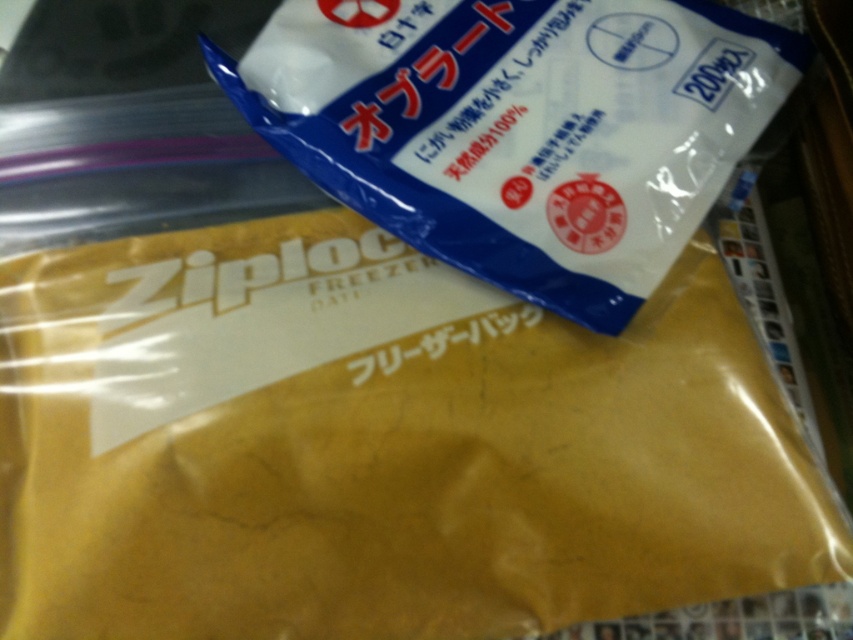
Question: Among these objects, which one is farthest from the camera?

Choices:
 (A) yellow matte ziploc bag at center
 (B) blue paper bag at upper center

Answer: (B)

Question: Can you confirm if yellow matte ziploc bag at center is thinner than blue paper bag at upper center?

Choices:
 (A) yes
 (B) no

Answer: (B)

Question: Does yellow matte ziploc bag at center appear on the right side of blue paper bag at upper center?

Choices:
 (A) no
 (B) yes

Answer: (A)

Question: Is yellow matte ziploc bag at center below blue paper bag at upper center?

Choices:
 (A) yes
 (B) no

Answer: (A)